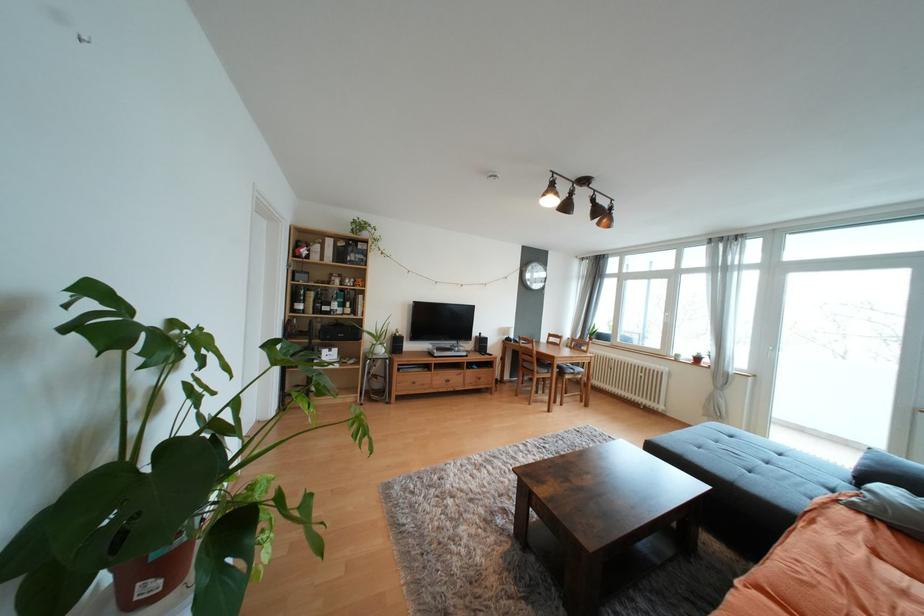
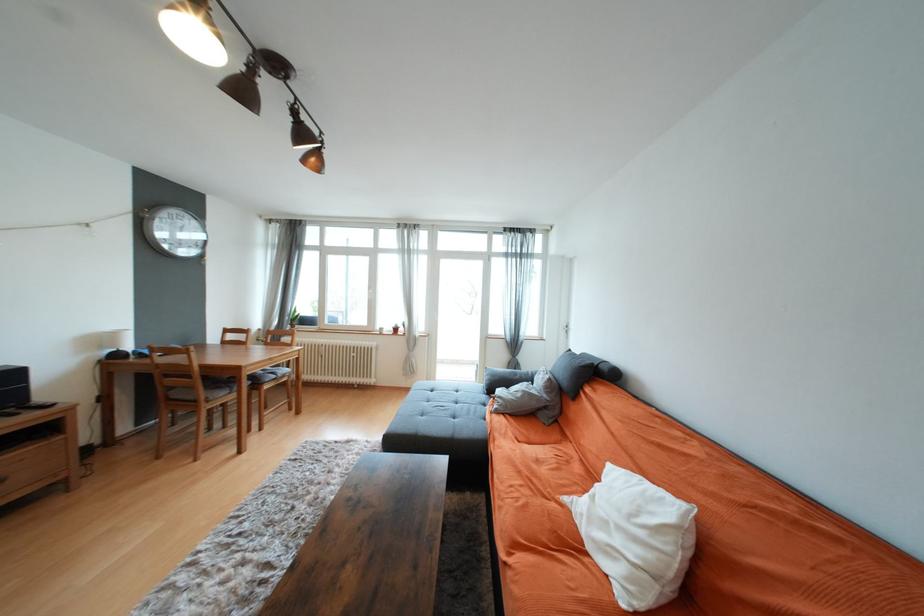
Where in the second image is the point corresponding to the point at 563,363 from the first image?

(253, 374)